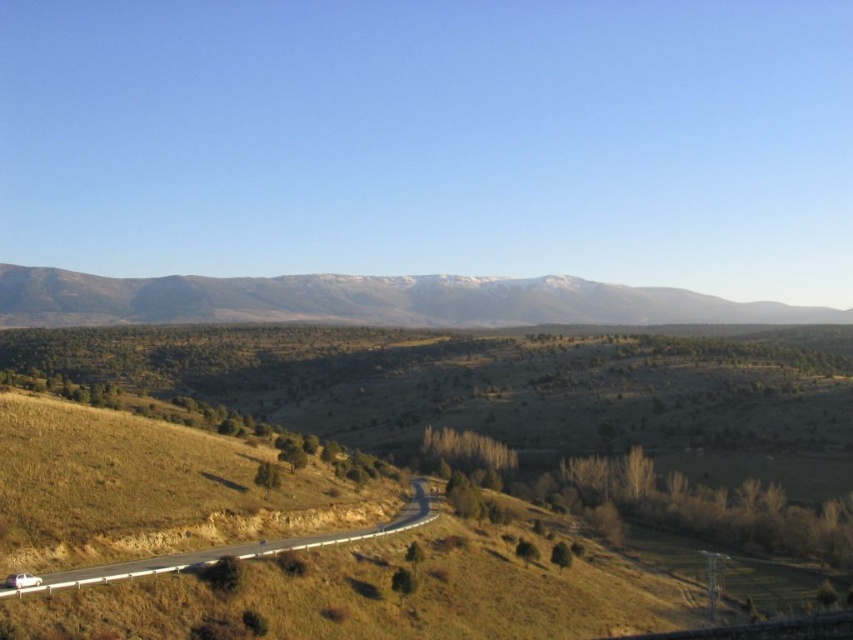
Question: Does snowy rock mountain range at upper center appear under asphalt road at lower left?

Choices:
 (A) no
 (B) yes

Answer: (A)

Question: Which point is farther from the camera taking this photo?

Choices:
 (A) (296, 538)
 (B) (700, 316)

Answer: (B)

Question: Can you confirm if snowy rock mountain range at upper center is positioned to the left of asphalt road at lower left?

Choices:
 (A) no
 (B) yes

Answer: (A)

Question: Is snowy rock mountain range at upper center in front of asphalt road at lower left?

Choices:
 (A) yes
 (B) no

Answer: (B)

Question: Which point is closer to the camera?

Choices:
 (A) asphalt road at lower left
 (B) snowy rock mountain range at upper center

Answer: (A)